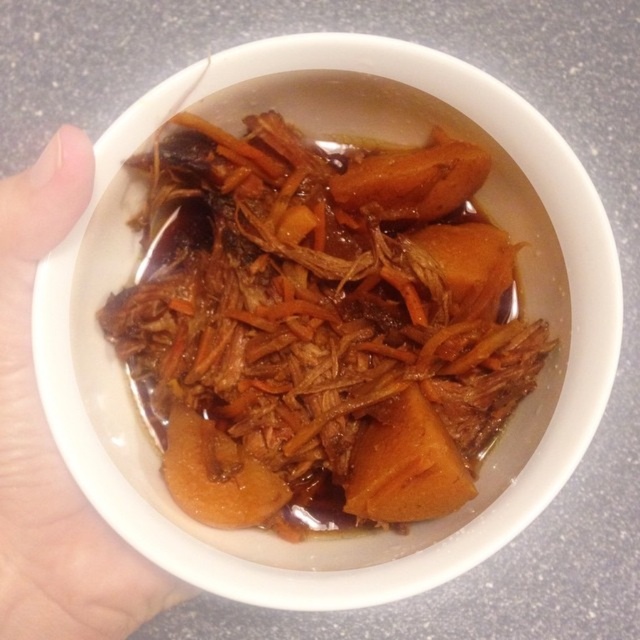
What is the 2D coordinate of the brown glossy shredded meat at center in the image?

The 2D coordinate of the brown glossy shredded meat at center is at point (321,326).

You are a food critic who needs to taste both the brown glossy shredded meat at center and the skinny flesh at lower left in the bowl. If your spoon is 6 inches long, can you reach both items without moving the bowl?

The distance between the brown glossy shredded meat at center and the skinny flesh at lower left is 8.42 inches. Since the spoon is only 6 inches long, you cannot reach both items without moving the bowl because the distance exceeds the spoon length.

You are a food critic evaluating this dish. Based on the image, which ingredient is positioned higher in the bowl between the brown glossy shredded meat at center and the skinny flesh at lower left?

The brown glossy shredded meat at center is positioned higher in the bowl than the skinny flesh at lower left.